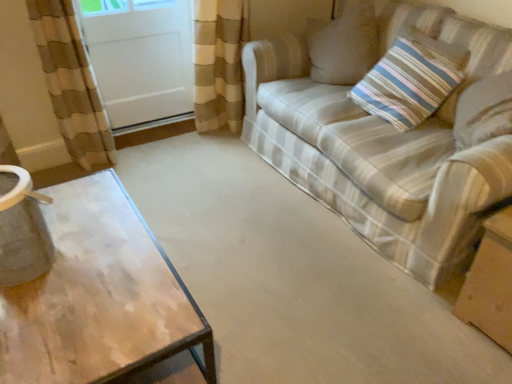
Question: Considering their positions, is white glossy screen door at upper left located in front of or behind striped fabric couch at right?

Choices:
 (A) behind
 (B) front

Answer: (A)

Question: From the image's perspective, is white glossy screen door at upper left positioned above or below striped fabric couch at right?

Choices:
 (A) above
 (B) below

Answer: (A)

Question: Which object is the farthest from the brown cardboard box at lower right?

Choices:
 (A) white glossy screen door at upper left
 (B) striped fabric couch at right
 (C) striped fabric pillow at upper right

Answer: (A)

Question: Which object is positioned closest to the white glossy screen door at upper left?

Choices:
 (A) striped fabric pillow at upper right
 (B) brown cardboard box at lower right
 (C) striped fabric couch at right

Answer: (C)